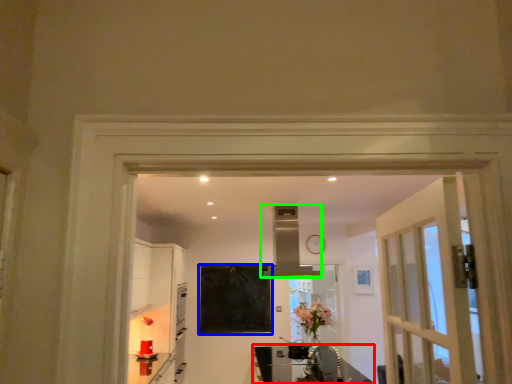
Question: Which is nearer to the table (highlighted by a red box)? bulletin board (highlighted by a blue box) or exhaust hood (highlighted by a green box).

Choices:
 (A) bulletin board
 (B) exhaust hood

Answer: (A)